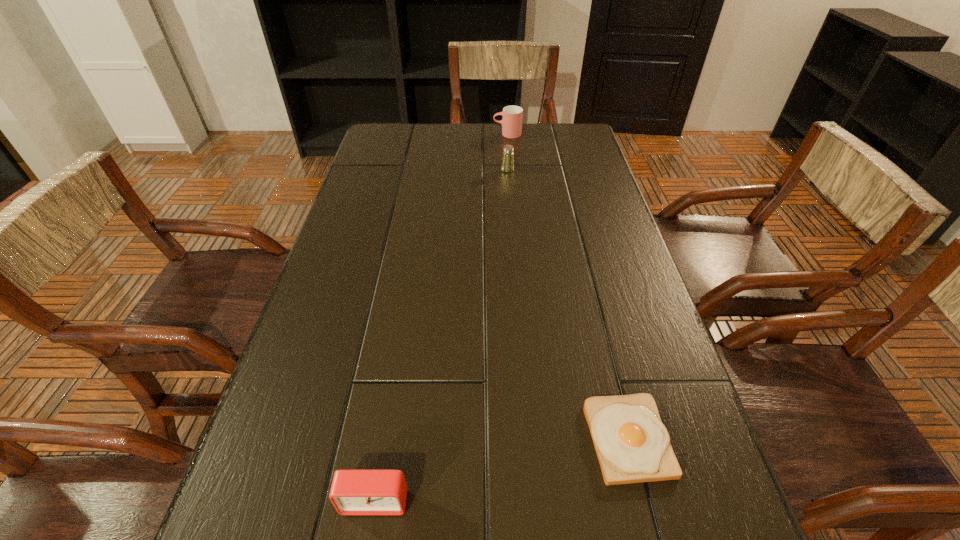
I want to click on object located in the far edge section of the desktop, so click(x=511, y=122).

Where is `object present at the right edge`? The width and height of the screenshot is (960, 540). object present at the right edge is located at coordinates (632, 444).

Identify the location of vacant space at the far edge of the desktop. (488, 154).

Locate an element on the screen. Image resolution: width=960 pixels, height=540 pixels. free region at the left edge of the desktop is located at coordinates (370, 172).

What are the coordinates of `vacant space at the right edge of the desktop` in the screenshot? It's located at (670, 506).

This screenshot has height=540, width=960. In order to click on vacant space at the far left corner in this screenshot , I will do `click(375, 137)`.

Where is `vacant region at the far right corner of the desktop`? This screenshot has height=540, width=960. vacant region at the far right corner of the desktop is located at coordinates (591, 147).

Locate an element on the screen. The image size is (960, 540). free point between the cup and the rightmost object is located at coordinates (567, 286).

This screenshot has width=960, height=540. I want to click on vacant space in between the saltshaker and the alarm clock, so click(442, 335).

At what (x,y) coordinates should I click in order to perform the action: click on free space between the cup and the toast. Please return your answer as a coordinate pair (x, y). This screenshot has width=960, height=540. Looking at the image, I should click on (567, 286).